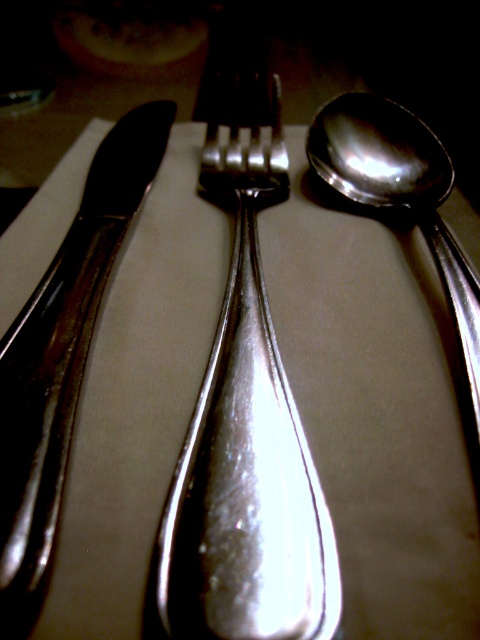
Describe the element at coordinates (245, 440) in the screenshot. The width and height of the screenshot is (480, 640). I see `polished silver fork at center` at that location.

Can you confirm if polished silver fork at center is shorter than polished silver knife at left?

No.

From the picture: Measure the distance between polished silver fork at center and camera.

10.95 inches

Locate an element on the screen. This screenshot has height=640, width=480. polished silver fork at center is located at coordinates (245, 440).

Does polished silver knife at left have a larger size compared to polished silver spoon at right?

Yes, polished silver knife at left is bigger than polished silver spoon at right.

Does polished silver knife at left have a lesser height compared to polished silver spoon at right?

In fact, polished silver knife at left may be taller than polished silver spoon at right.

What do you see at coordinates (61, 358) in the screenshot? The image size is (480, 640). I see `polished silver knife at left` at bounding box center [61, 358].

You are a GUI agent. You are given a task and a screenshot of the screen. Output one action in this format:
    pyautogui.click(x=<x>, y=<y>)
    Task: Click on the polished silver knife at left
    
    Given the screenshot: What is the action you would take?
    pyautogui.click(x=61, y=358)

Is polished silver fork at center bigger than polished silver spoon at right?

Yes, polished silver fork at center is bigger than polished silver spoon at right.

Which is behind, point (251, 323) or point (337, 108)?

The point (337, 108) is behind.

Where is `polished silver fork at center`? The width and height of the screenshot is (480, 640). polished silver fork at center is located at coordinates (245, 440).